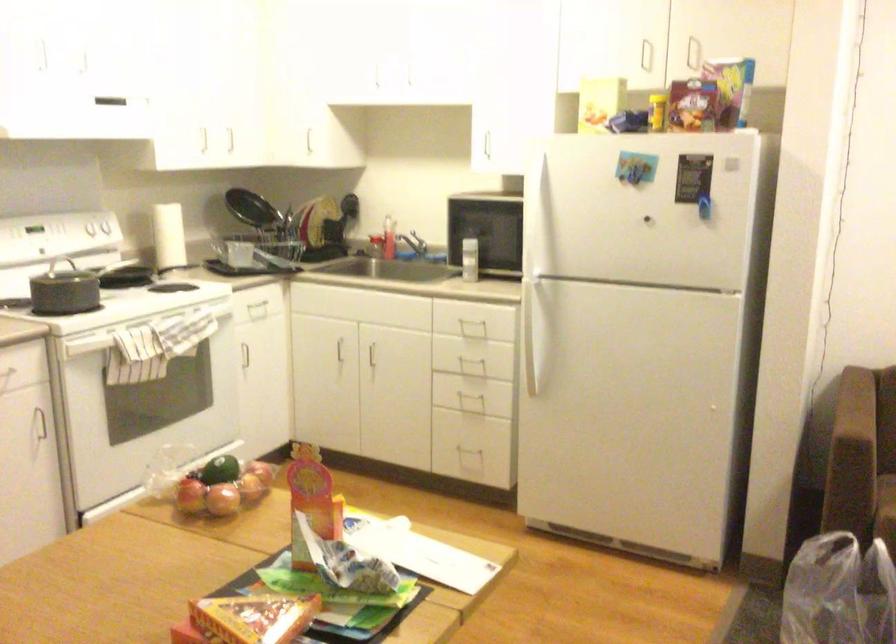
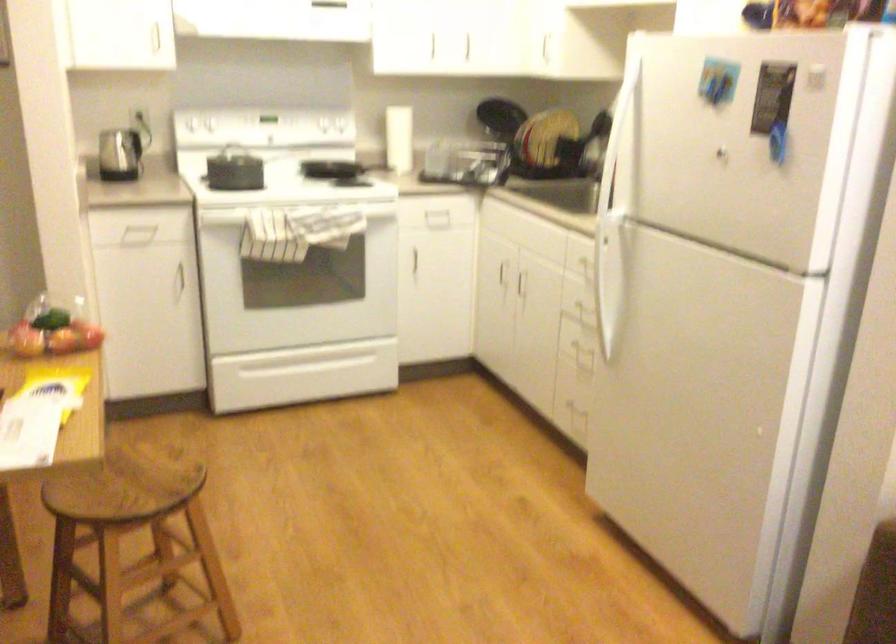
Question: I am providing you with two images of the same scene from different viewpoints. After the viewpoint changes to image2, which objects are now occluded?

Choices:
 (A) red award medal
 (B) kettle handle
 (C) white refrigerator handle
 (D) sink faucet handle

Answer: (D)